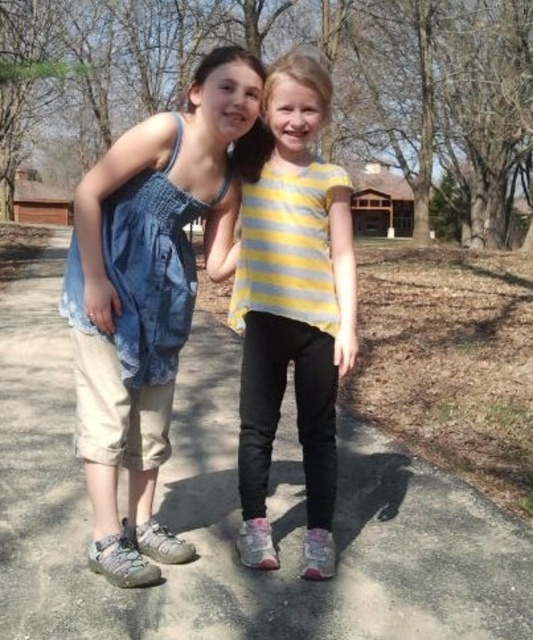
Consider the image. How much distance is there between smooth concrete path at center and denim fabric at center?

4.80 feet

Can you confirm if smooth concrete path at center is positioned above denim fabric at center?

No.

This screenshot has width=533, height=640. Describe the element at coordinates (235, 515) in the screenshot. I see `smooth concrete path at center` at that location.

The image size is (533, 640). In order to click on smooth concrete path at center in this screenshot , I will do `click(235, 515)`.

Find the location of a particular element. smooth concrete path at center is located at coordinates (235, 515).

Can you confirm if smooth concrete path at center is thinner than yellow striped shirt at center?

Indeed, smooth concrete path at center has a lesser width compared to yellow striped shirt at center.

You are a GUI agent. You are given a task and a screenshot of the screen. Output one action in this format:
    pyautogui.click(x=<x>, y=<y>)
    Task: Click on the smooth concrete path at center
    
    Given the screenshot: What is the action you would take?
    pyautogui.click(x=235, y=515)

Where is `smooth concrete path at center`? smooth concrete path at center is located at coordinates (235, 515).

Is point (208, 250) positioned before point (349, 301)?

No, it is not.

Which is behind, point (228, 125) or point (263, 285)?

The point (263, 285) is more distant.

Describe the element at coordinates (149, 294) in the screenshot. The image size is (533, 640). I see `denim fabric at center` at that location.

Find the location of `denim fabric at center`. denim fabric at center is located at coordinates pos(149,294).